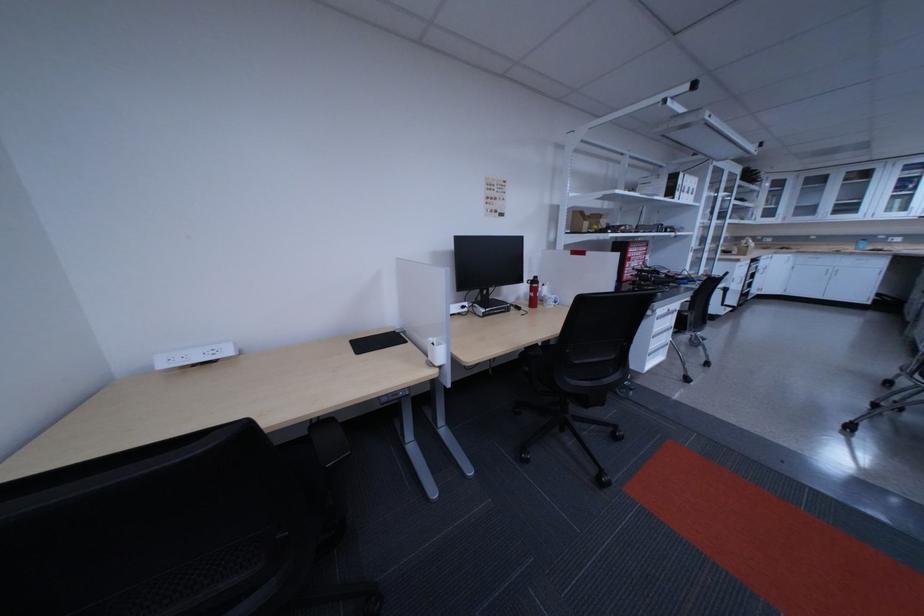
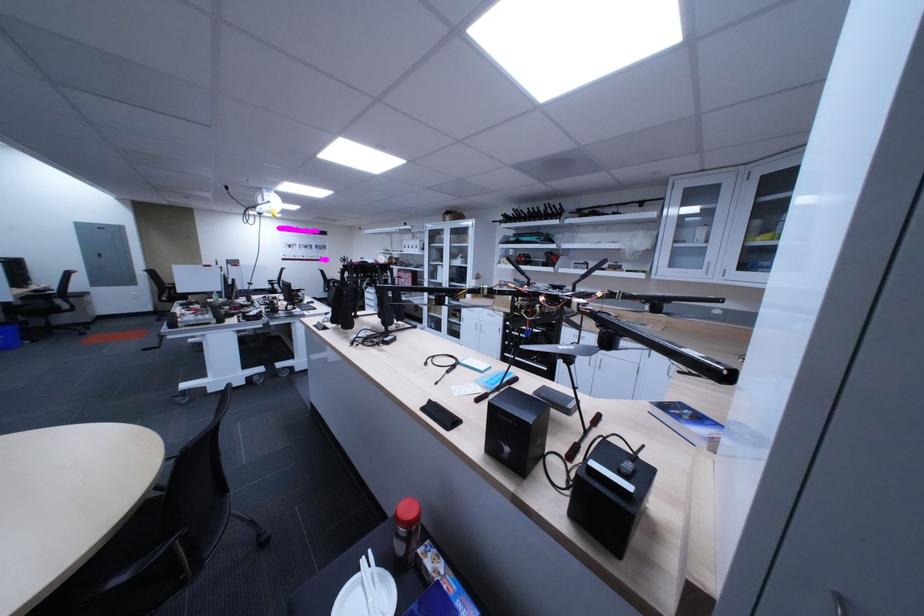
The point at (748, 283) is marked in the first image. Where is the corresponding point in the second image?

(478, 323)